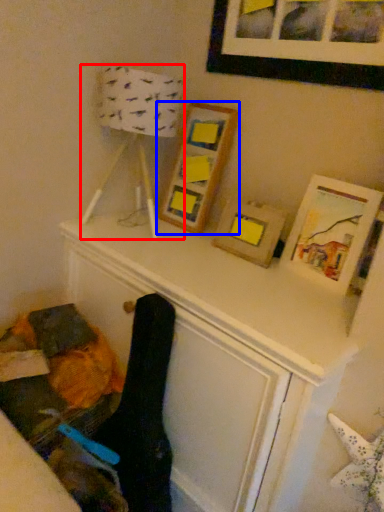
Question: Which of the following is the closest to the observer, table lamp (highlighted by a red box) or picture frame (highlighted by a blue box)?

Choices:
 (A) table lamp
 (B) picture frame

Answer: (A)